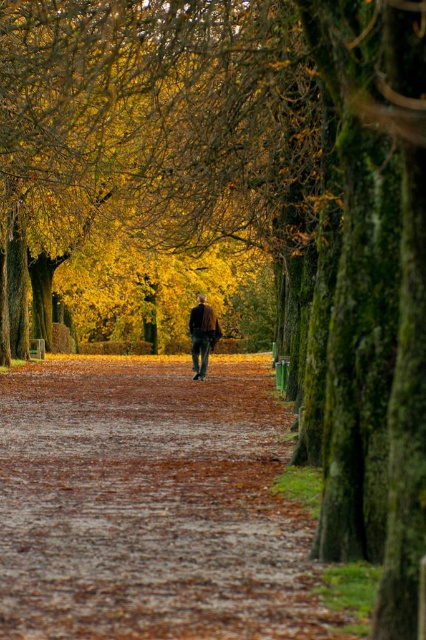
Can you confirm if brown leafy path at center is wider than dark brown leather jacket at center?

Correct, the width of brown leafy path at center exceeds that of dark brown leather jacket at center.

From the picture: Is brown leafy path at center shorter than dark brown leather jacket at center?

Yes.

Does point (219, 422) come closer to viewer compared to point (207, 339)?

Yes, it is.

Where is `brown leafy path at center`? brown leafy path at center is located at coordinates (149, 506).